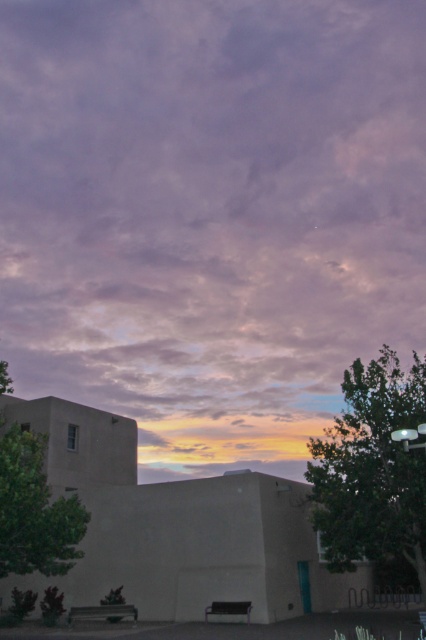
Between point (402, 525) and point (19, 515), which one is positioned behind?

Point (402, 525)

Does green leafy tree at right have a greater height compared to green leafy tree at left?

Correct, green leafy tree at right is much taller as green leafy tree at left.

At what (x,y) coordinates should I click in order to perform the action: click on green leafy tree at right. Please return your answer as a coordinate pair (x, y). This screenshot has height=640, width=426. Looking at the image, I should click on (373, 468).

Who is more forward, (282,147) or (71,532)?

Point (71,532) is more forward.

Does point (302, 186) come closer to viewer compared to point (6, 547)?

No, (302, 186) is behind (6, 547).

Identify the location of purple matte cloud at upper center. (210, 214).

Which of these two, purple matte cloud at upper center or green leafy tree at right, stands taller?

With more height is purple matte cloud at upper center.

Which is below, purple matte cloud at upper center or green leafy tree at right?

Positioned lower is green leafy tree at right.

Between point (161, 312) and point (391, 445), which one is positioned in front?

Positioned in front is point (391, 445).

This screenshot has width=426, height=640. Find the location of `purple matte cloud at upper center`. purple matte cloud at upper center is located at coordinates (210, 214).